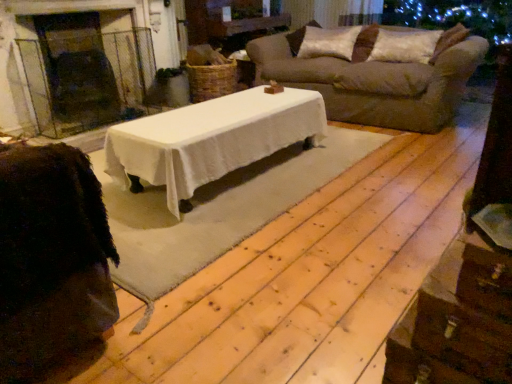
Question: Can you confirm if velvet brown pillow at upper right, the second pillow from the left, is taller than silky beige pillow at upper right, the first pillow when ordered from left to right?

Choices:
 (A) yes
 (B) no

Answer: (B)

Question: Does velvet brown pillow at upper right, which is the first pillow in right-to-left order, have a larger size compared to silky beige pillow at upper right, the first pillow when ordered from left to right?

Choices:
 (A) no
 (B) yes

Answer: (A)

Question: Does velvet brown pillow at upper right, the second pillow from the left, turn towards silky beige pillow at upper right, which is counted as the 2th pillow, starting from the right?

Choices:
 (A) yes
 (B) no

Answer: (B)

Question: Can you confirm if velvet brown pillow at upper right, which is the first pillow in right-to-left order, is positioned to the right of silky beige pillow at upper right, the first pillow when ordered from left to right?

Choices:
 (A) no
 (B) yes

Answer: (B)

Question: Considering the relative positions of velvet brown pillow at upper right, the second pillow from the left, and silky beige pillow at upper right, the first pillow when ordered from left to right, in the image provided, is velvet brown pillow at upper right, the second pillow from the left, behind silky beige pillow at upper right, the first pillow when ordered from left to right,?

Choices:
 (A) yes
 (B) no

Answer: (B)

Question: From the image's perspective, is velvet brown pillow at upper right, the second pillow from the left, located beneath silky beige pillow at upper right, the first pillow when ordered from left to right?

Choices:
 (A) no
 (B) yes

Answer: (B)

Question: Is silky beige pillow at upper right, which is counted as the 2th pillow, starting from the right, behind velvet brown pillow at upper right, the second pillow from the left?

Choices:
 (A) no
 (B) yes

Answer: (B)

Question: Can you confirm if silky beige pillow at upper right, the first pillow when ordered from left to right, is bigger than velvet brown pillow at upper right, the second pillow from the left?

Choices:
 (A) yes
 (B) no

Answer: (A)

Question: Considering the relative positions of silky beige pillow at upper right, the first pillow when ordered from left to right, and velvet brown pillow at upper right, which is the first pillow in right-to-left order, in the image provided, is silky beige pillow at upper right, the first pillow when ordered from left to right, to the left of velvet brown pillow at upper right, which is the first pillow in right-to-left order, from the viewer's perspective?

Choices:
 (A) yes
 (B) no

Answer: (A)

Question: Is silky beige pillow at upper right, which is counted as the 2th pillow, starting from the right, facing towards velvet brown pillow at upper right, which is the first pillow in right-to-left order?

Choices:
 (A) yes
 (B) no

Answer: (B)

Question: Can you confirm if silky beige pillow at upper right, which is counted as the 2th pillow, starting from the right, is wider than velvet brown pillow at upper right, which is the first pillow in right-to-left order?

Choices:
 (A) yes
 (B) no

Answer: (A)

Question: From a real-world perspective, is silky beige pillow at upper right, which is counted as the 2th pillow, starting from the right, under velvet brown pillow at upper right, the second pillow from the left?

Choices:
 (A) yes
 (B) no

Answer: (A)

Question: From the image's perspective, is silky beige pillow at upper right, the first pillow when ordered from left to right, above glass fireplace at left?

Choices:
 (A) no
 (B) yes

Answer: (B)